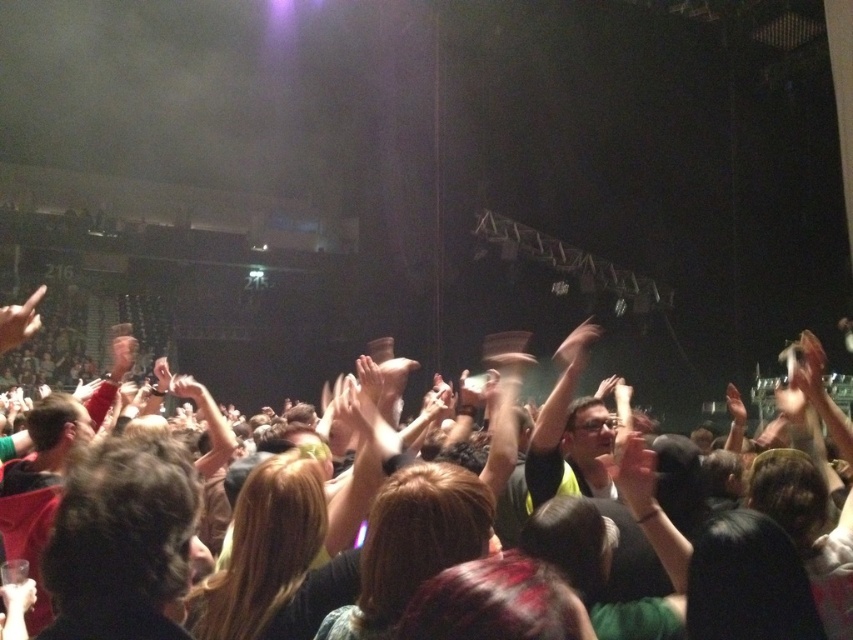
Does matte black hand at center have a greater height compared to matte black hand at lower left?

Yes, matte black hand at center is taller than matte black hand at lower left.

Is matte black hand at center bigger than matte black hand at lower left?

Yes.

Which is in front, point (573, 353) or point (0, 588)?

Positioned in front is point (0, 588).

The height and width of the screenshot is (640, 853). Identify the location of matte black hand at center. (577, 342).

Can you confirm if dark brown hair at center is smaller than matte skin hand at upper right?

Yes, dark brown hair at center is smaller than matte skin hand at upper right.

This screenshot has width=853, height=640. What do you see at coordinates (122, 541) in the screenshot?
I see `dark brown hair at center` at bounding box center [122, 541].

Where is `dark brown hair at center`? The height and width of the screenshot is (640, 853). dark brown hair at center is located at coordinates (122, 541).

Does translucent skin hand at center have a smaller size compared to matte black hand at center?

Yes, translucent skin hand at center is smaller than matte black hand at center.

Does translucent skin hand at center appear over matte black hand at center?

Actually, translucent skin hand at center is below matte black hand at center.

Locate an element on the screen. The width and height of the screenshot is (853, 640). translucent skin hand at center is located at coordinates (634, 474).